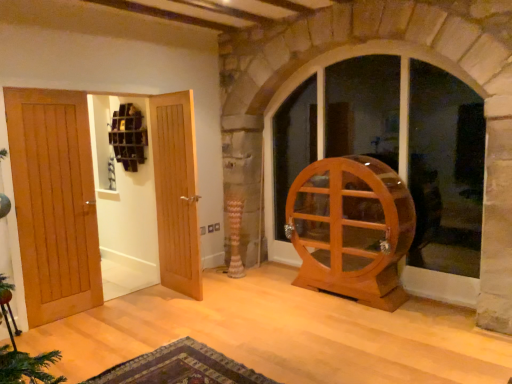
This screenshot has width=512, height=384. Find the location of `vacant space that is to the left of light brown wood hamster wheel at right`. vacant space that is to the left of light brown wood hamster wheel at right is located at coordinates (275, 301).